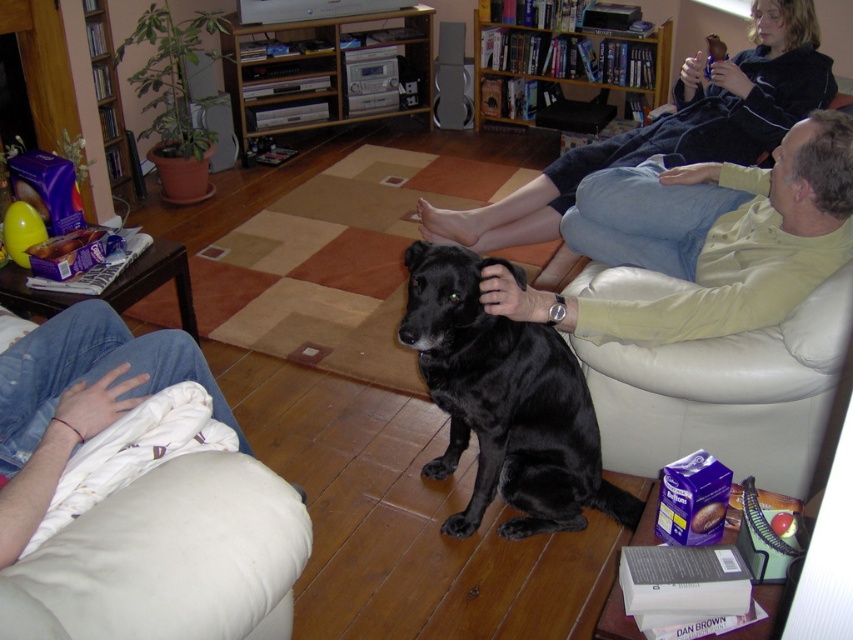
You are standing in the living room and want to place a small plant between the two points marked as point (x=706, y=282) and point (x=471, y=384). Which point should the plant be closer to so it is nearer to the viewer?

The plant should be placed closer to point (x=706, y=282) because it is closer to the viewer than point (x=471, y=384).

You are a photographer setting up a tripod in the living room. You need to position the camera so that both the matte yellow shirt at center and the black fur dog at center are clearly visible. Given their heights, which object should be placed closer to the camera to ensure both are in focus?

The matte yellow shirt at center is shorter than the black fur dog at center. To ensure both are in focus, position the matte yellow shirt at center closer to the camera since it is shorter, allowing the camera to capture both subjects effectively.